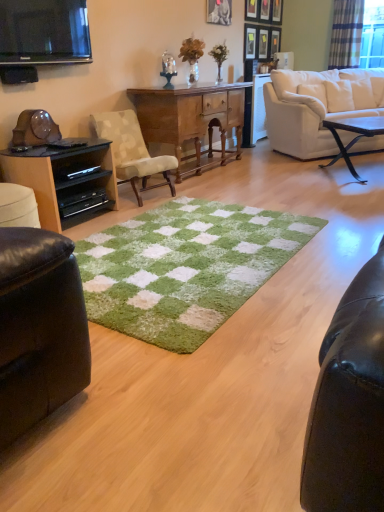
Question: Is point (264, 18) closer or farther from the camera than point (129, 123)?

Choices:
 (A) closer
 (B) farther

Answer: (B)

Question: In the image, is wooden picture frame at upper center, which is the 4th picture frame from right to left, on the left side or the right side of beige fabric chair at center?

Choices:
 (A) left
 (B) right

Answer: (B)

Question: Which object is the closest to the black glossy entertainment center at left?

Choices:
 (A) wooden picture frame at upper center, placed as the third picture frame when sorted from right to left
 (B) wooden picture frame at upper center, marked as the 2th picture frame in a left-to-right arrangement
 (C) metallic silver picture frame at upper center, which appears as the third picture frame when viewed from the left
 (D) white fabric couch at upper right
 (E) wooden desk at center

Answer: (E)

Question: Which is nearer to the beige fabric chair at center?

Choices:
 (A) wooden picture frame at upper center, marked as the 2th picture frame in a left-to-right arrangement
 (B) green shaggy rug at center
 (C) flat screen tv at upper left
 (D) metallic silver picture frame at upper center, the first picture frame positioned from the left
 (E) black glossy entertainment center at left

Answer: (E)